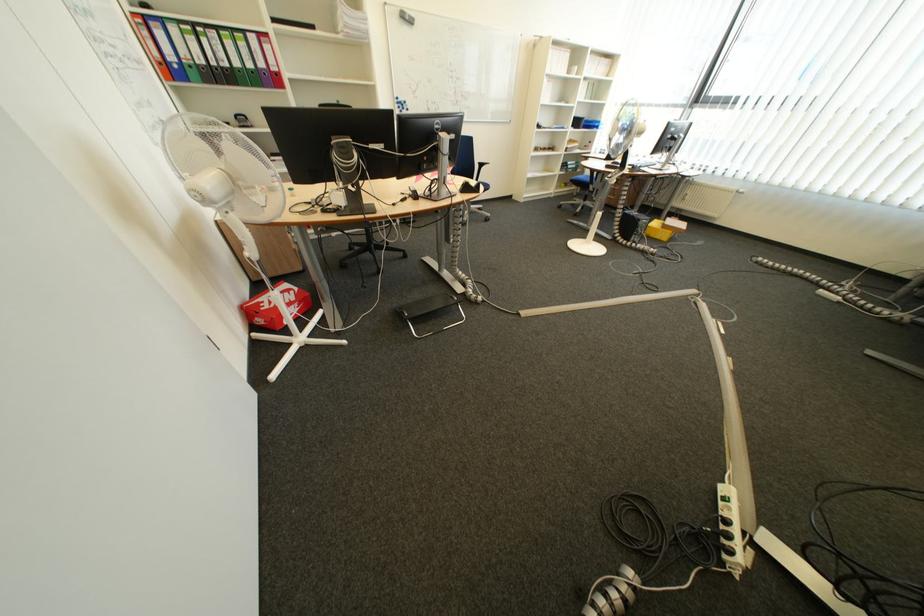
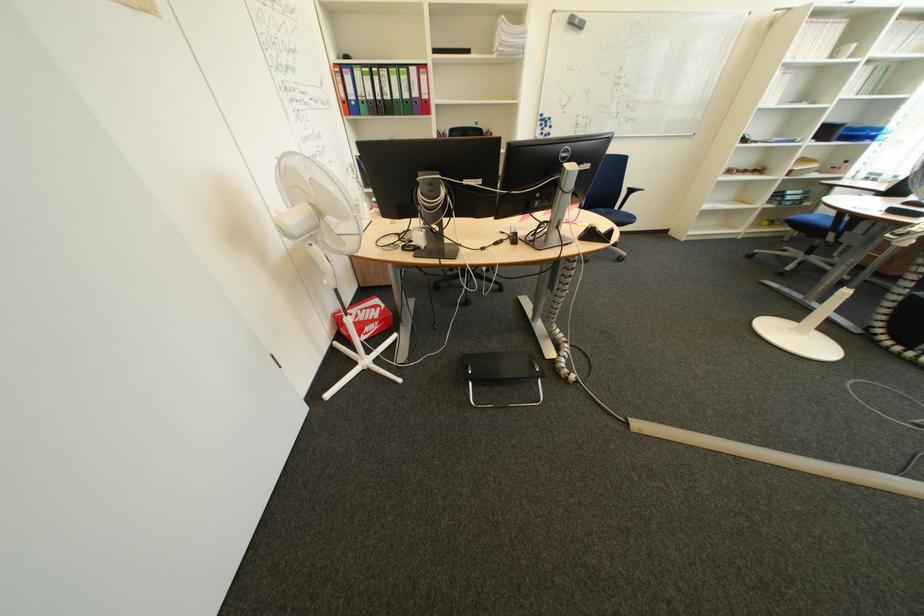
In the second image, find the point that corresponds to (x=590, y=124) in the first image.

(840, 132)